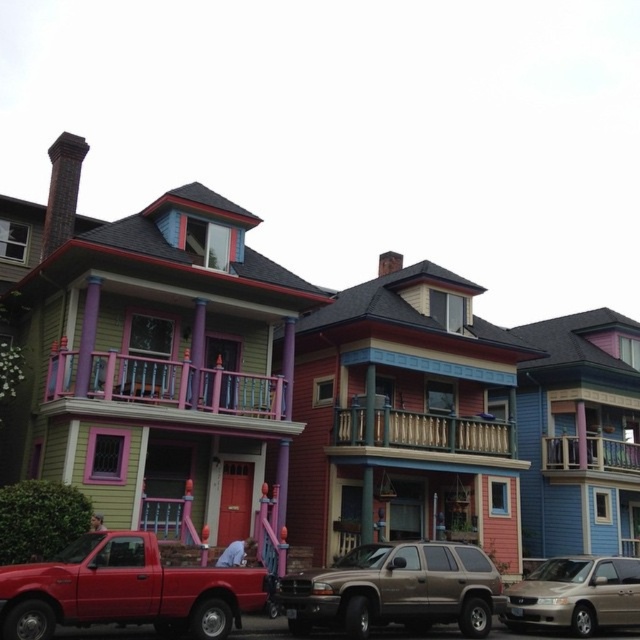
You are standing in front of the row of houses and notice two points marked on the image. The first point is at coordinate point (106, 413) and the second point is at coordinate point (376, 419). Which point is closer to you?

Point (106, 413) is in front of point (376, 419), so it is closer to you.